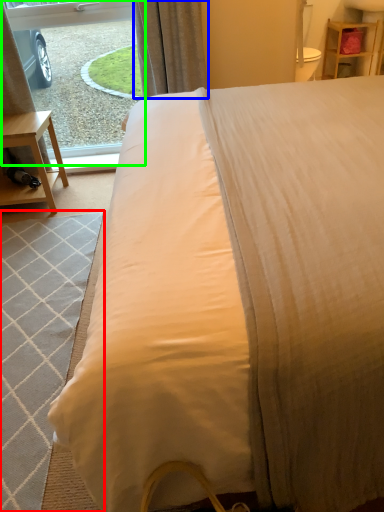
Question: Which object is positioned farthest from mat (highlighted by a red box)? Select from curtain (highlighted by a blue box) and window screen (highlighted by a green box).

Choices:
 (A) curtain
 (B) window screen

Answer: (B)